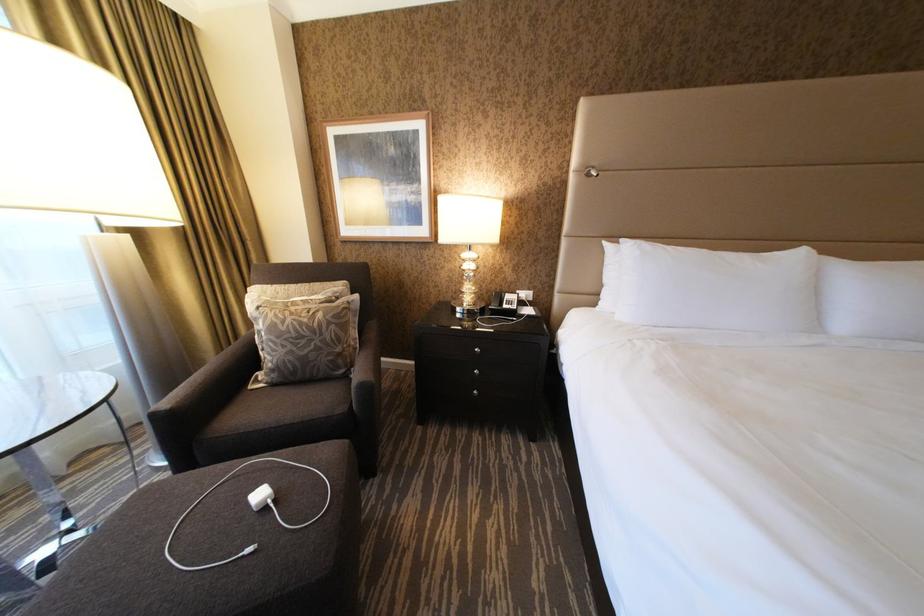
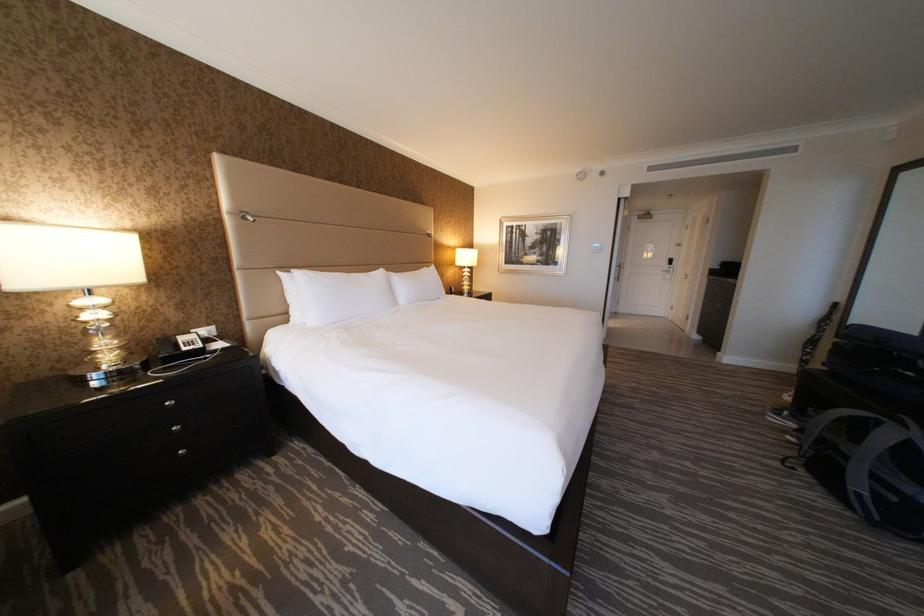
Question: Based on the continuous images, in which direction is the camera rotating? Reply with the corresponding letter.

Choices:
 (A) Left
 (B) Right
 (C) Up
 (D) Down

Answer: (B)